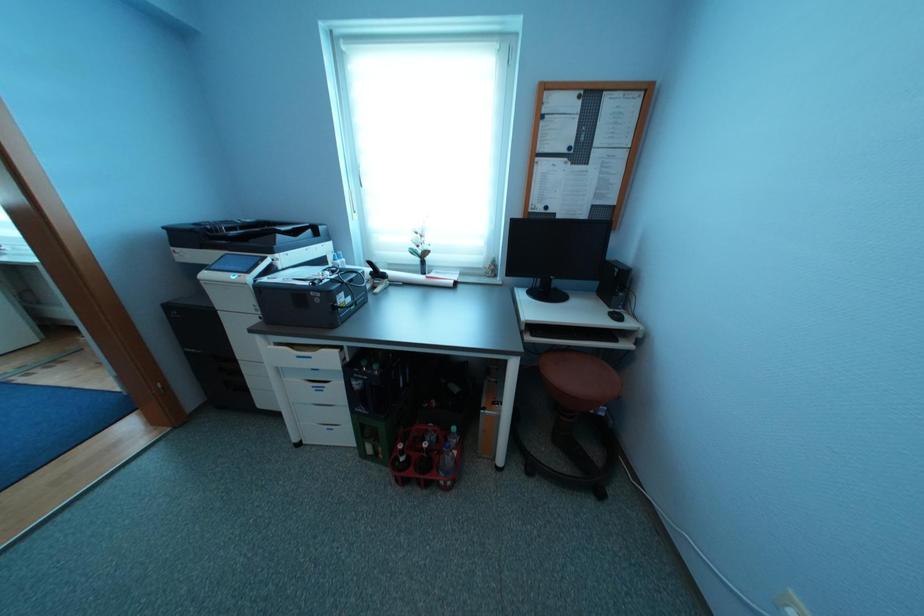
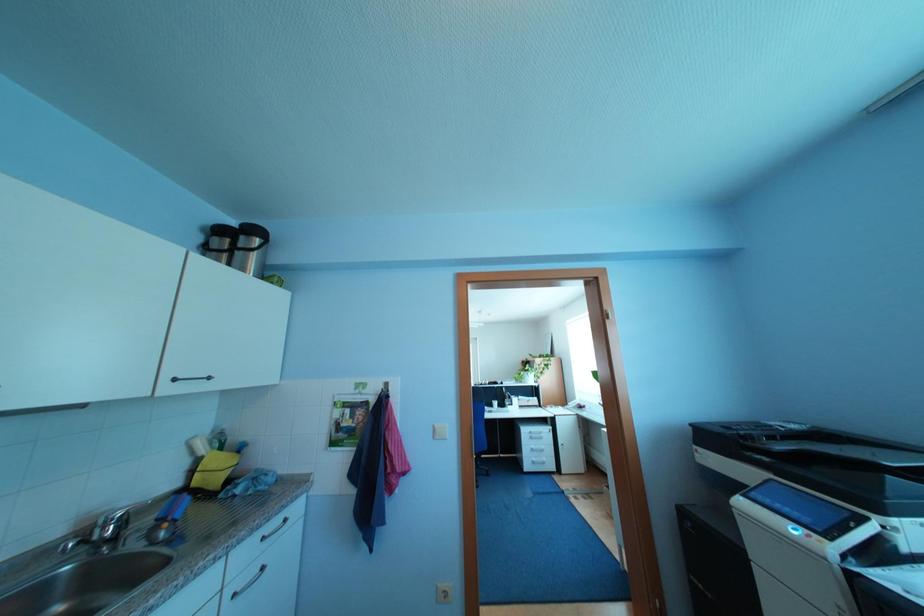
The images are taken continuously from a first-person perspective. In which direction is your viewpoint rotating?

The camera's rotation is toward left-up.